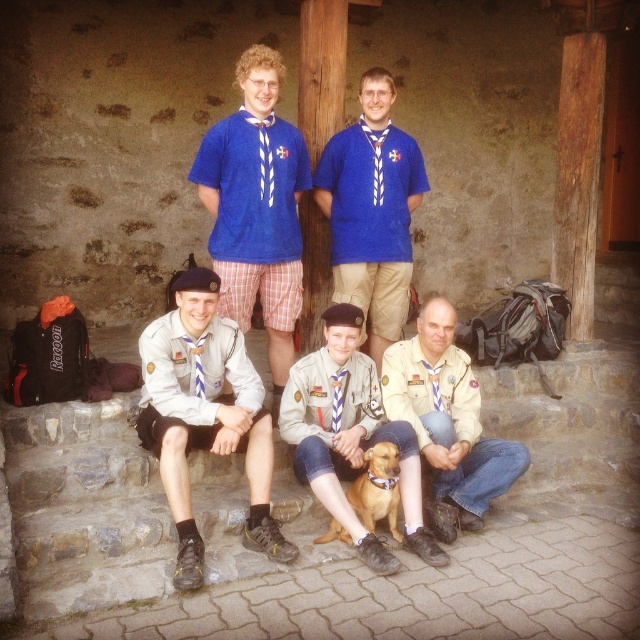
You are a photographer trying to capture a photo of the scouts. You notice the blue knitted sweater at upper center and the brown leather dog at center. Which object should you focus on first if you want to ensure both are in focus without adjusting your camera settings?

The blue knitted sweater at upper center is located above the brown leather dog at center. To ensure both are in focus, you should focus on the brown leather dog at center first since it is closer to the camera, and the sweater being above it would be in the same focal plane if the depth of field is sufficient.

You are standing at the point with coordinates point (364, 506) and want to walk towards the point with coordinates point (419, 166). According to the scene, will you be moving forward or backward?

Since point (419, 166) is behind point (364, 506), moving towards it would mean you are moving backward.

You are a photographer trying to capture a clear shot of the light brown uniform at center and the light brown leather jacket at center. Which one is located to the left of the other?

The light brown uniform at center is positioned on the left side of light brown leather jacket at center.